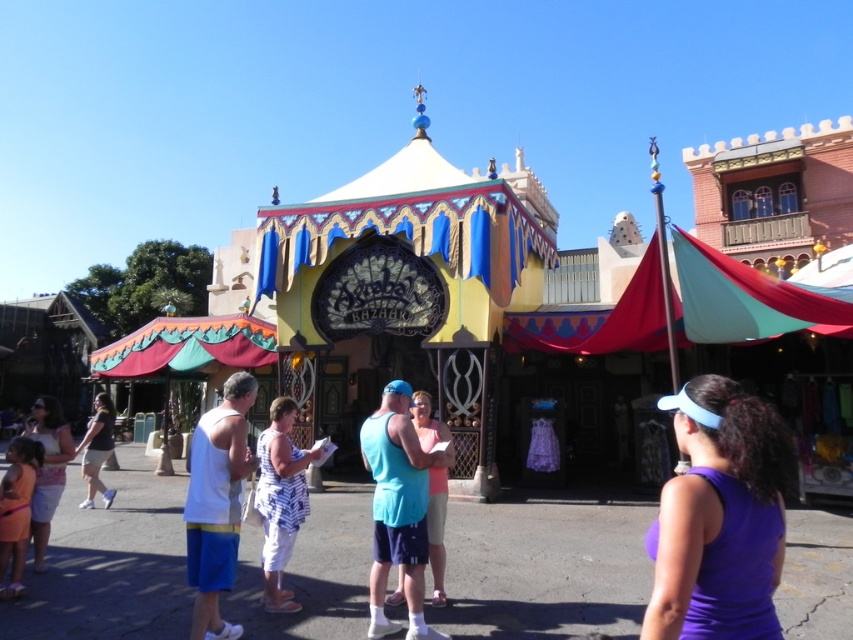
Question: Which point is closer to the camera?

Choices:
 (A) (277, 490)
 (B) (22, 545)
 (C) (94, 451)

Answer: (A)

Question: Which point is farther from the camera taking this photo?

Choices:
 (A) (61, 428)
 (B) (12, 520)
 (C) (444, 467)

Answer: (A)

Question: Where is purple fabric visor at center located in relation to white tank top at center in the image?

Choices:
 (A) below
 (B) above

Answer: (B)

Question: Can you confirm if textured fabric canopy at left is smaller than blue cotton tank top at center?

Choices:
 (A) no
 (B) yes

Answer: (B)

Question: Which point appears farthest from the camera in this image?

Choices:
 (A) (279, 422)
 (B) (444, 588)
 (C) (236, 332)
 (D) (56, 406)

Answer: (C)

Question: From the image, what is the correct spatial relationship of textured fabric canopy at left in relation to orange cotton dress at lower left?

Choices:
 (A) below
 (B) above

Answer: (B)